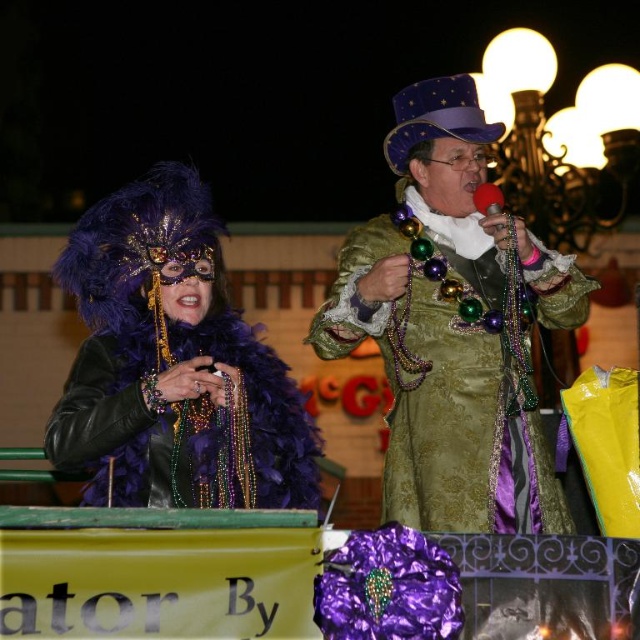
You are helping organize a costume party and need to ensure that the shiny gold coat at center and the purple feather boa at center can be displayed together in a showcase. Given that the showcase has a maximum width of 1.2 meters, can both items be displayed side by side without overlapping?

The shiny gold coat at center is larger in size than the purple feather boa at center, but the exact dimensions are not provided. However, since the showcase has a maximum width of 1.2 meters, it is possible that both items can fit side by side if their combined width does not exceed the limit. Further measurements would be needed to confirm.

You are standing at the point labeled as point (76,260) and want to move towards the point labeled as point (472,380). Which direction should you move to get closer to your destination?

To move towards point (472,380) from point (76,260), you should move upwards and to the right since point (472,380) is located above and to the right of point (76,260).